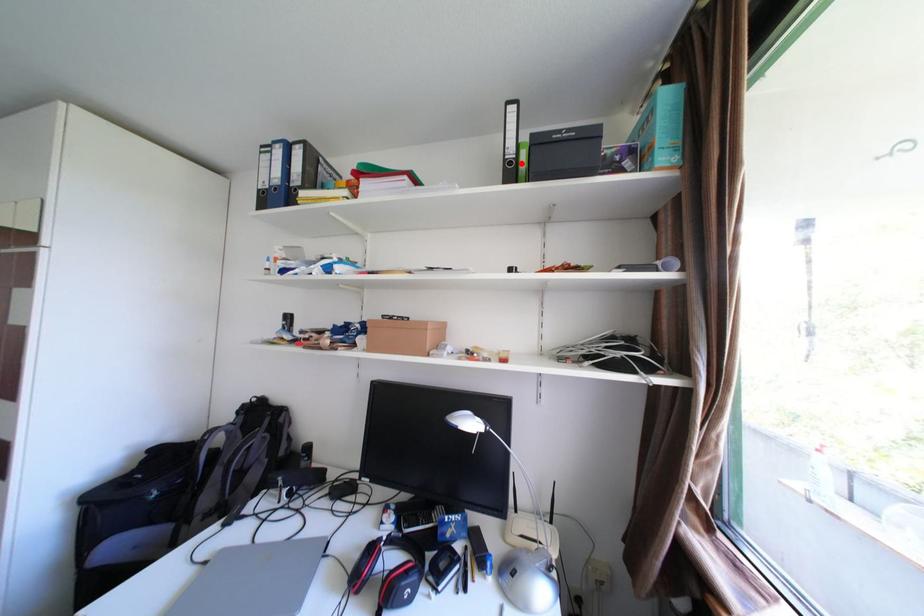
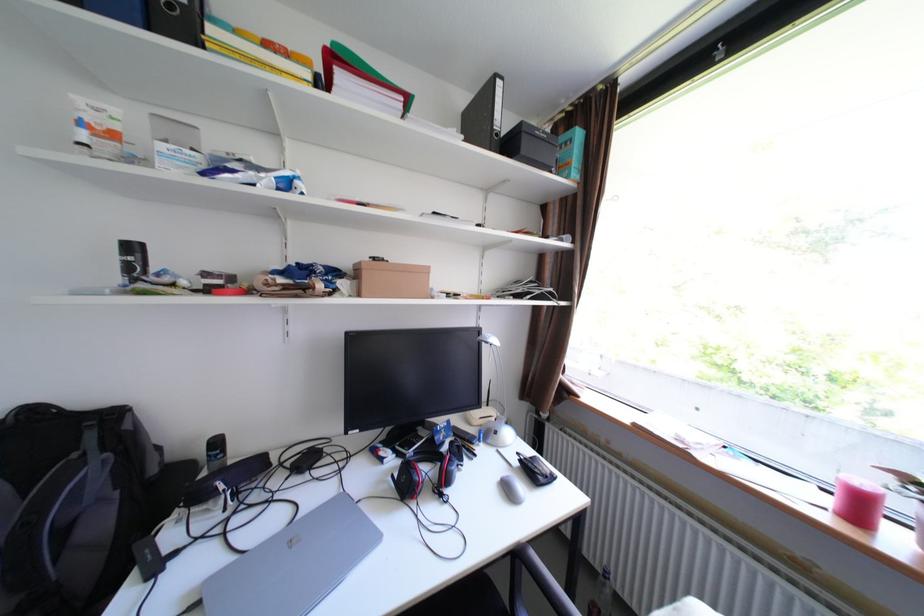
Locate, in the second image, the point that corresponds to the highlighted location in the first image.

(507, 135)